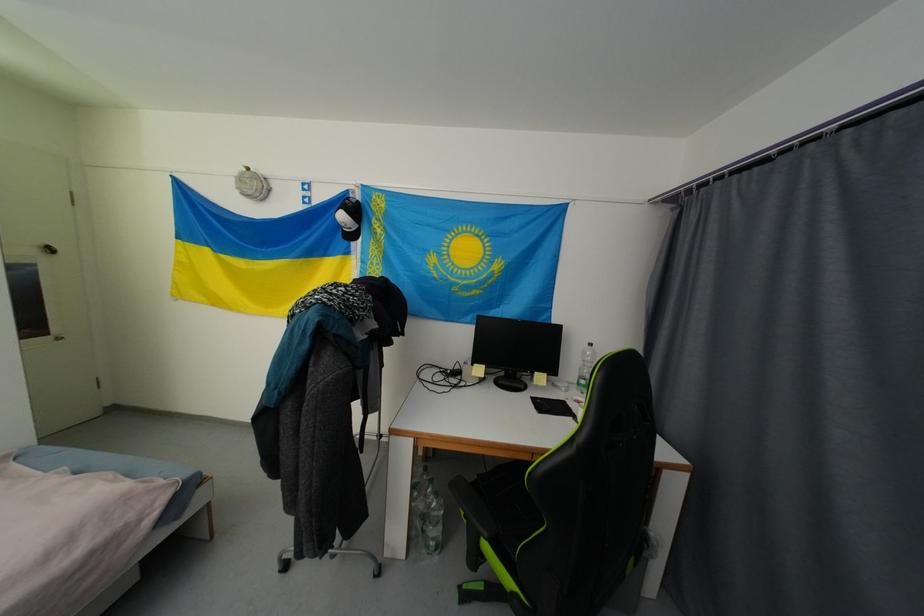
The image size is (924, 616). Identify the location of large plastic bottle. (426, 514).